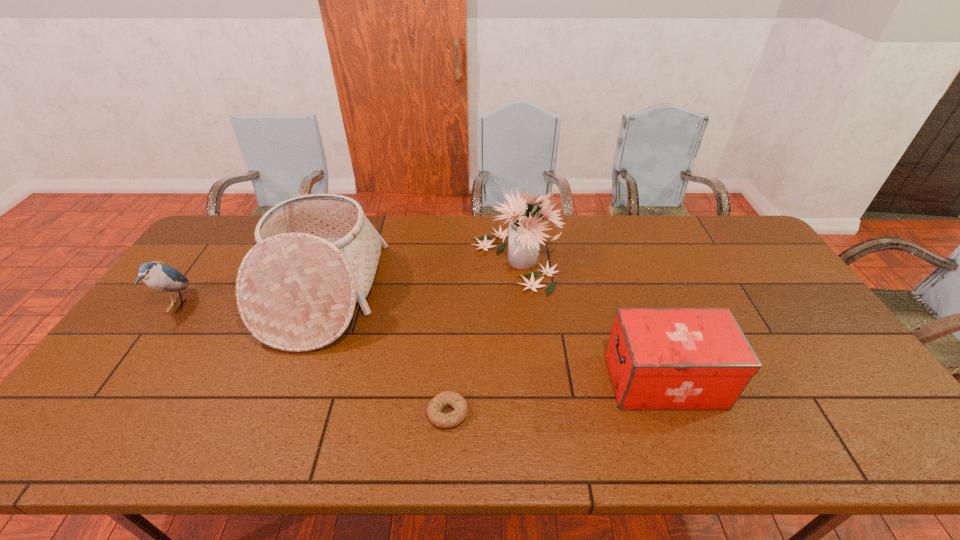
You are a GUI agent. You are given a task and a screenshot of the screen. Output one action in this format:
    pyautogui.click(x=<x>, y=<y>)
    Task: Click on the vacant space located 0.110m on the handle side of the first-aid kit
    
    Given the screenshot: What is the action you would take?
    pyautogui.click(x=564, y=381)

Find the location of `free region located 0.110m on the right of the shortest object`. free region located 0.110m on the right of the shortest object is located at coordinates (516, 413).

I want to click on bouquet that is at the far edge, so click(525, 235).

Identify the location of basket at the far edge. (316, 256).

The height and width of the screenshot is (540, 960). What are the coordinates of `object located in the near edge section of the desktop` in the screenshot? It's located at (455, 400).

Image resolution: width=960 pixels, height=540 pixels. In order to click on object located in the left edge section of the desktop in this screenshot , I will do `click(161, 277)`.

In the image, there is a desktop. Identify the location of free space at the far edge. (627, 225).

Locate an element on the screen. free point at the near edge is located at coordinates (421, 426).

You are a GUI agent. You are given a task and a screenshot of the screen. Output one action in this format:
    pyautogui.click(x=<x>, y=<y>)
    Task: Click on the blank space at the left edge of the desktop
    This screenshot has height=540, width=960.
    Given the screenshot: What is the action you would take?
    pyautogui.click(x=134, y=349)

The width and height of the screenshot is (960, 540). Identify the location of free region at the right edge of the desktop. (760, 325).